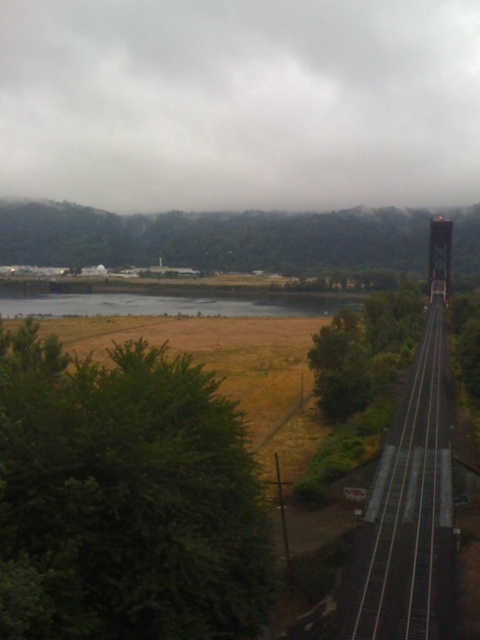
You are standing at the point closer to the viewer between the two points, point (412,300) and point (435,225). Which point are you standing at?

You are standing at point (412,300) because it is closer to the viewer than point (435,225).